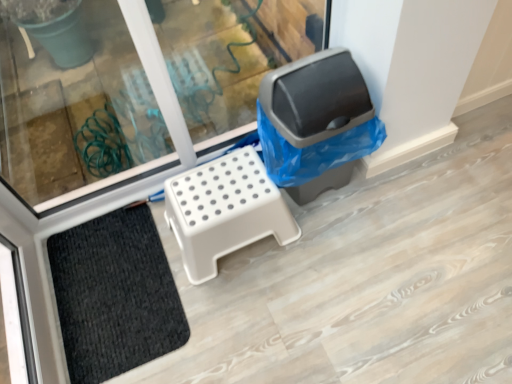
Question: Is white plastic step stool at center inside or outside of gray plastic recycling bin at right?

Choices:
 (A) inside
 (B) outside

Answer: (B)

Question: Based on their sizes in the image, would you say white plastic step stool at center is bigger or smaller than gray plastic recycling bin at right?

Choices:
 (A) big
 (B) small

Answer: (B)

Question: Based on their relative distances, which object is farther from the black textured mat at lower left?

Choices:
 (A) white plastic step stool at center
 (B) gray plastic recycling bin at right

Answer: (B)

Question: Considering the real-world distances, which object is closest to the black textured mat at lower left?

Choices:
 (A) gray plastic recycling bin at right
 (B) white plastic step stool at center

Answer: (B)